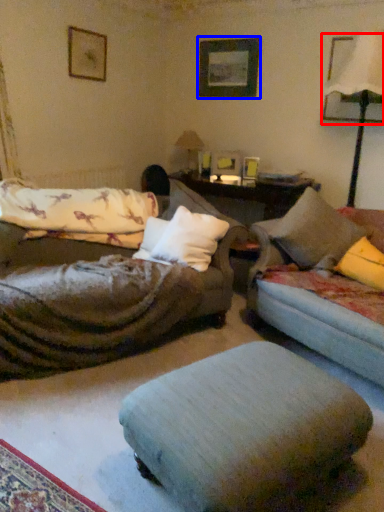
Question: Which object is further to the camera taking this photo, picture frame (highlighted by a red box) or picture frame (highlighted by a blue box)?

Choices:
 (A) picture frame
 (B) picture frame

Answer: (B)